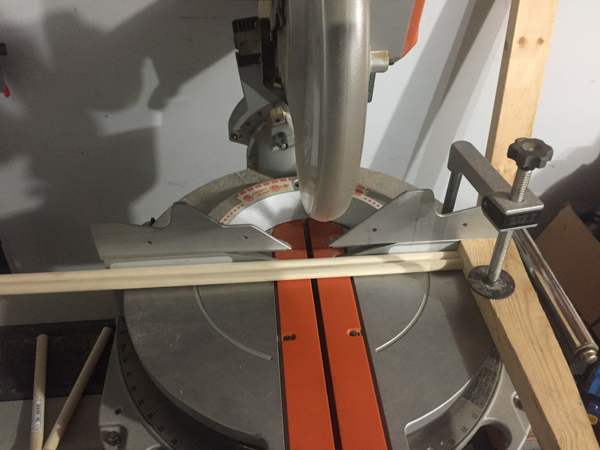
This screenshot has height=450, width=600. I want to click on rod, so click(x=60, y=422), click(x=35, y=417), click(x=574, y=332), click(x=495, y=265).